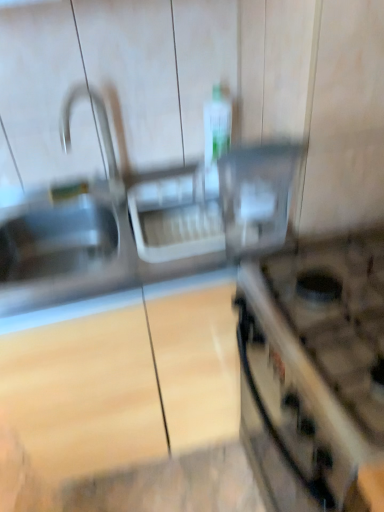
The image size is (384, 512). Describe the element at coordinates (217, 126) in the screenshot. I see `translucent plastic bottle at center` at that location.

Where is `satin nickel faucet at upper left`? This screenshot has width=384, height=512. satin nickel faucet at upper left is located at coordinates (100, 133).

This screenshot has width=384, height=512. I want to click on translucent plastic bottle at center, so click(217, 126).

Is translucent plastic bottle at center at the back of satin nickel faucet at upper left?

That's not correct — satin nickel faucet at upper left is not looking away from translucent plastic bottle at center.

How distant is satin nickel faucet at upper left from translucent plastic bottle at center?

A distance of 12.68 inches exists between satin nickel faucet at upper left and translucent plastic bottle at center.

From the image's perspective, between satin nickel faucet at upper left and translucent plastic bottle at center, who is located below?

satin nickel faucet at upper left.

From a real-world perspective, who is located lower, satin nickel faucet at upper left or translucent plastic bottle at center?

translucent plastic bottle at center, from a real-world perspective.

Considering the relative sizes of metallic silver gas stove at right and clear plastic container at center in the image provided, is metallic silver gas stove at right shorter than clear plastic container at center?

No.

In the scene shown: Would you say metallic silver gas stove at right is to the left or to the right of clear plastic container at center in the picture?

Based on their positions, metallic silver gas stove at right is located to the right of clear plastic container at center.

From a real-world perspective, is metallic silver gas stove at right physically above clear plastic container at center?

Actually, metallic silver gas stove at right is physically below clear plastic container at center in the real world.

Which is less distant, [317,379] or [239,183]?

Clearly, point [317,379] is closer to the camera than point [239,183].

Identify the location of bottle behind the satin nickel faucet at upper left. (217, 126).

In terms of size, does translucent plastic bottle at center appear bigger or smaller than satin nickel faucet at upper left?

Clearly, translucent plastic bottle at center is smaller in size than satin nickel faucet at upper left.

Considering the sizes of objects translucent plastic bottle at center and satin nickel faucet at upper left in the image provided, who is wider, translucent plastic bottle at center or satin nickel faucet at upper left?

Wider between the two is satin nickel faucet at upper left.

From the image's perspective, would you say translucent plastic bottle at center is shown under satin nickel faucet at upper left?

No.

Between point (235, 254) and point (214, 110), which one is positioned behind?

Point (214, 110)

How far apart are clear plastic container at center and translucent plastic bottle at center?

clear plastic container at center and translucent plastic bottle at center are 12.17 inches apart from each other.

Can you see clear plastic container at center touching translucent plastic bottle at center?

No, clear plastic container at center is not touching translucent plastic bottle at center.

Considering the relative sizes of clear plastic container at center and translucent plastic bottle at center in the image provided, is clear plastic container at center bigger than translucent plastic bottle at center?

Yes.

Considering the sizes of objects clear plastic container at center and metallic silver gas stove at right in the image provided, who is taller, clear plastic container at center or metallic silver gas stove at right?

metallic silver gas stove at right is taller.

From a real-world perspective, which is physically below, clear plastic container at center or metallic silver gas stove at right?

metallic silver gas stove at right is physically lower.

Is clear plastic container at center not close to metallic silver gas stove at right?

clear plastic container at center is near metallic silver gas stove at right, not far away.

Between metallic silver gas stove at right and satin nickel faucet at upper left, which one is positioned behind?

satin nickel faucet at upper left.

Would you say metallic silver gas stove at right is inside or outside satin nickel faucet at upper left?

metallic silver gas stove at right lies outside satin nickel faucet at upper left.

Considering the positions of objects metallic silver gas stove at right and satin nickel faucet at upper left in the image provided, who is more to the left, metallic silver gas stove at right or satin nickel faucet at upper left?

Positioned to the left is satin nickel faucet at upper left.

How distant is metallic silver gas stove at right from satin nickel faucet at upper left?

27.80 inches.

Measure the distance from translucent plastic bottle at center to clear plastic container at center.

translucent plastic bottle at center is 12.17 inches away from clear plastic container at center.

Does translucent plastic bottle at center have a lesser width compared to clear plastic container at center?

Incorrect, the width of translucent plastic bottle at center is not less than that of clear plastic container at center.

Where is `appliance on the right of translucent plastic bottle at center`? The image size is (384, 512). appliance on the right of translucent plastic bottle at center is located at coordinates (257, 196).

Is translucent plastic bottle at center at the left side of clear plastic container at center?

Yes, translucent plastic bottle at center is to the left of clear plastic container at center.

The width and height of the screenshot is (384, 512). In the image, there is a translucent plastic bottle at center. In order to click on faucet below it (from the image's perspective) in this screenshot , I will do `click(100, 133)`.

Where is `gas stove below the clear plastic container at center (from a real-world perspective)`? gas stove below the clear plastic container at center (from a real-world perspective) is located at coordinates (313, 371).

Looking at the image, which one is located further to satin nickel faucet at upper left, clear plastic container at center or translucent plastic bottle at center?

clear plastic container at center is positioned further to the anchor satin nickel faucet at upper left.

Looking at the image, which one is located closer to satin nickel faucet at upper left, clear plastic container at center or metallic silver gas stove at right?

clear plastic container at center is closer to satin nickel faucet at upper left.

Looking at the image, which one is located further to metallic silver gas stove at right, clear plastic container at center or translucent plastic bottle at center?

translucent plastic bottle at center is further to metallic silver gas stove at right.

Based on their spatial positions, is metallic silver gas stove at right or translucent plastic bottle at center closer to clear plastic container at center?

metallic silver gas stove at right lies closer to clear plastic container at center than the other object.

When comparing their distances from translucent plastic bottle at center, does satin nickel faucet at upper left or clear plastic container at center seem further?

satin nickel faucet at upper left.

When comparing their distances from clear plastic container at center, does satin nickel faucet at upper left or translucent plastic bottle at center seem further?

satin nickel faucet at upper left is positioned further to the anchor clear plastic container at center.

Considering their positions, is translucent plastic bottle at center positioned further to satin nickel faucet at upper left than metallic silver gas stove at right?

metallic silver gas stove at right is further to satin nickel faucet at upper left.

When comparing their distances from satin nickel faucet at upper left, does metallic silver gas stove at right or translucent plastic bottle at center seem closer?

translucent plastic bottle at center.

Find the location of a particular element. The width and height of the screenshot is (384, 512). faucet between translucent plastic bottle at center and metallic silver gas stove at right from top to bottom is located at coordinates (100, 133).

Where is `bottle between satin nickel faucet at upper left and clear plastic container at center`? bottle between satin nickel faucet at upper left and clear plastic container at center is located at coordinates (217, 126).

This screenshot has height=512, width=384. In order to click on appliance between translucent plastic bottle at center and metallic silver gas stove at right vertically in this screenshot , I will do `click(257, 196)`.

Locate an element on the screen. The width and height of the screenshot is (384, 512). appliance between satin nickel faucet at upper left and metallic silver gas stove at right in the vertical direction is located at coordinates (257, 196).